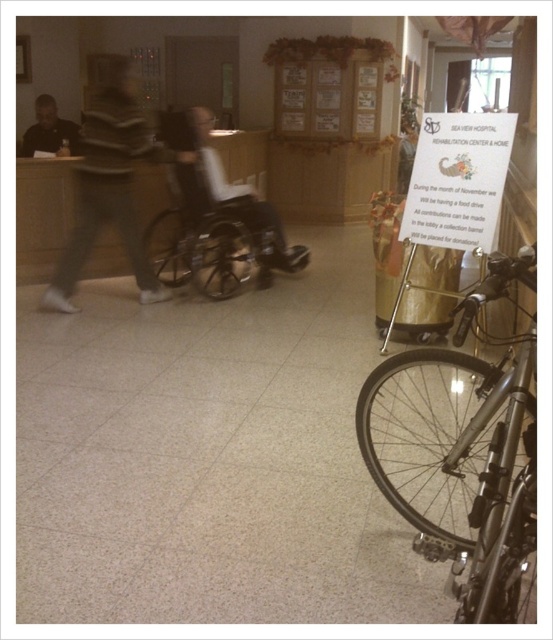
You are a patient who needs to reach the black plastic wheelchair at center from your current position near the reception desk. Is the wheelchair positioned in a direction that you would need to look downward to see it from the matte black shirt at upper left?

The black plastic wheelchair at center is located below the matte black shirt at upper left, so yes, you would need to look downward to see the wheelchair from the position of the matte black shirt at upper left.

You are a patient in the Sea View Hospital Rehabilitation Center. You need to retrieve your belongings from the reception desk but notice the shiny metallic bicycle at lower right and the gray striped sweater at center. Which object is closer to the floor?

The shiny metallic bicycle at lower right is closer to the floor because it is below the gray striped sweater at center.

You are a physical therapist in the Sea View Hospital Rehabilitation Center. You need to choose between the matte black wheelchair at center and the black plastic wheelchair at center for a patient who requires a narrower wheelchair to navigate narrow hallways. Which wheelchair should you choose?

The matte black wheelchair at center is thinner than the black plastic wheelchair at center, so you should choose the matte black wheelchair at center for navigating narrow hallways.